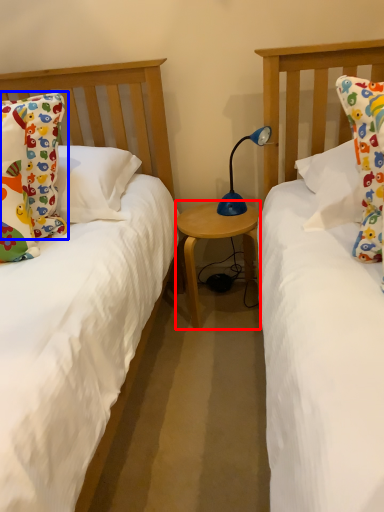
Question: Which point is closer to the camera, table (highlighted by a red box) or pillow (highlighted by a blue box)?

Choices:
 (A) table
 (B) pillow

Answer: (B)